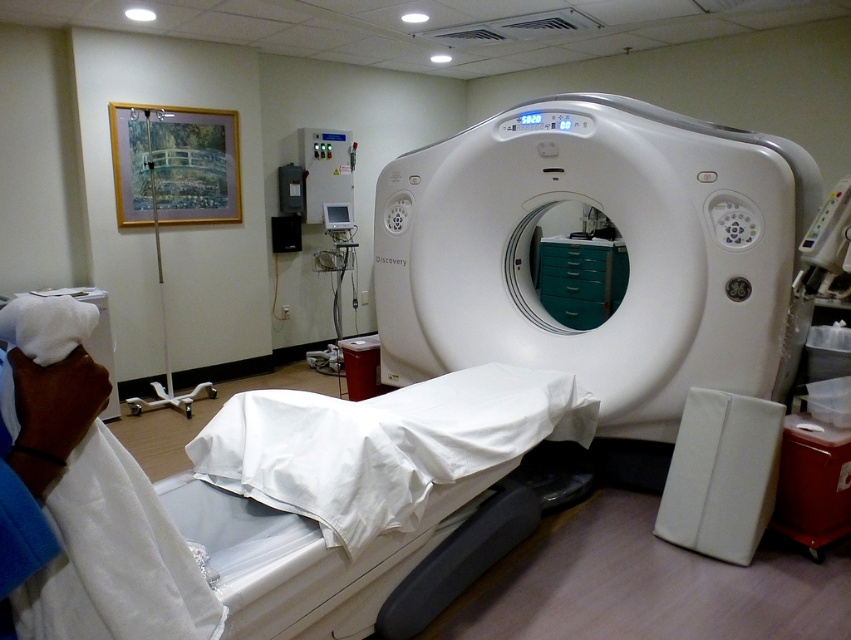
Question: Is white glossy ct scanner at center wider than white plastic pole at left?

Choices:
 (A) no
 (B) yes

Answer: (B)

Question: Which point is closer to the camera?

Choices:
 (A) white glossy ct scanner at center
 (B) white plastic pole at left

Answer: (A)

Question: Does white glossy ct scanner at center appear under white plastic pole at left?

Choices:
 (A) no
 (B) yes

Answer: (B)

Question: Can you confirm if white glossy ct scanner at center is positioned to the right of white plastic pole at left?

Choices:
 (A) no
 (B) yes

Answer: (B)

Question: Among these points, which one is nearest to the camera?

Choices:
 (A) (147, 128)
 (B) (677, 141)

Answer: (B)

Question: Which of the following is the closest to the observer?

Choices:
 (A) white glossy ct scanner at center
 (B) white plastic pole at left

Answer: (A)